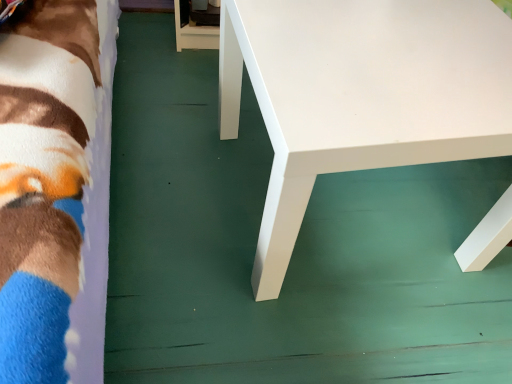
What do you see at coordinates (361, 95) in the screenshot?
I see `white matte table at center` at bounding box center [361, 95].

Identify the location of white matte table at center. (361, 95).

This screenshot has width=512, height=384. Identify the location of white matte table at center. (361, 95).